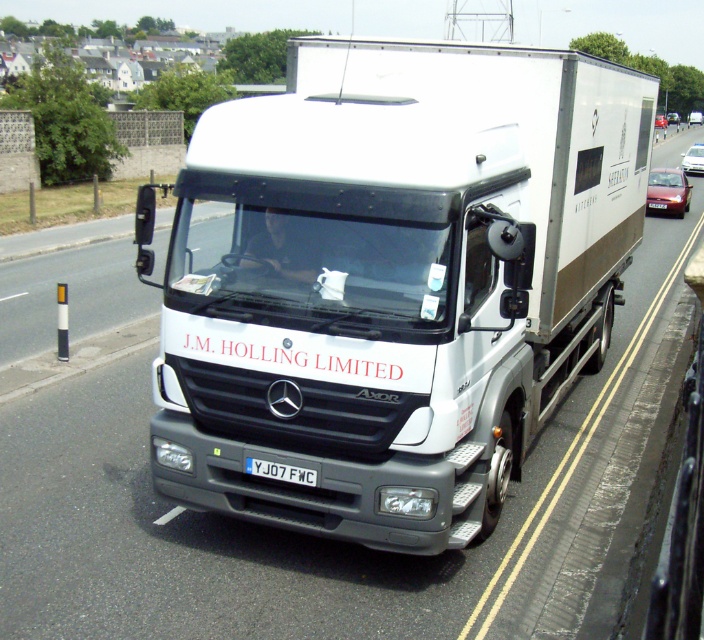
Question: Among these points, which one is farthest from the camera?

Choices:
 (A) (315, 470)
 (B) (658, 116)
 (C) (301, 432)
 (D) (647, 200)

Answer: (D)

Question: In this image, where is metallic red car at right located relative to metallic silver sedan at center?

Choices:
 (A) right
 (B) left

Answer: (B)

Question: Among these points, which one is farthest from the camera?

Choices:
 (A) (658, 122)
 (B) (670, 179)
 (C) (584, 252)
 (D) (303, 468)

Answer: (B)

Question: Is white matte trailer truck at center bigger than shiny red sedan at center?

Choices:
 (A) yes
 (B) no

Answer: (B)

Question: Can you confirm if metallic red car at right is positioned to the left of white plastic license plate at center?

Choices:
 (A) no
 (B) yes

Answer: (A)

Question: Which point is farther to the camera?

Choices:
 (A) (289, 481)
 (B) (686, 170)

Answer: (B)